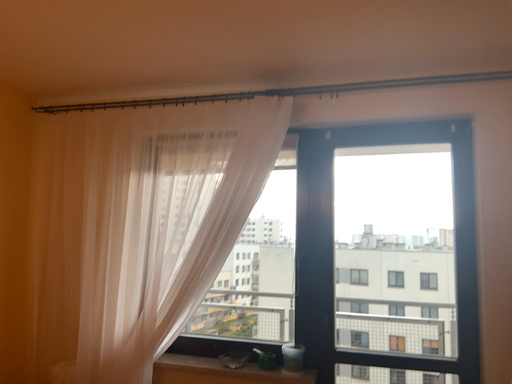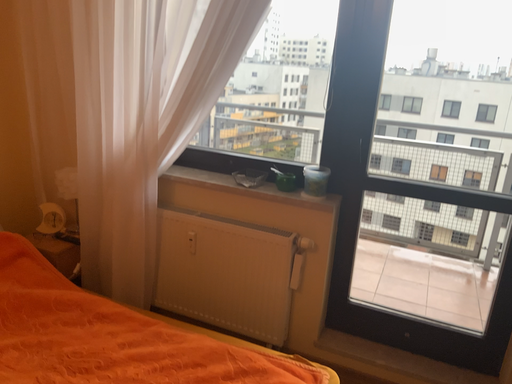
Question: Which way did the camera rotate in the video?

Choices:
 (A) rotated right
 (B) rotated left

Answer: (B)